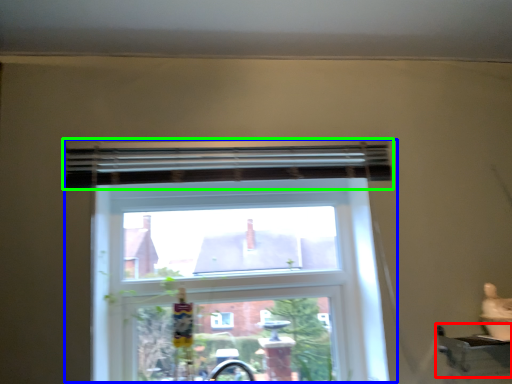
Question: Which object is the farthest from window sill (highlighted by a red box)? Choose among these: window (highlighted by a blue box) or curtain (highlighted by a green box).

Choices:
 (A) window
 (B) curtain

Answer: (B)